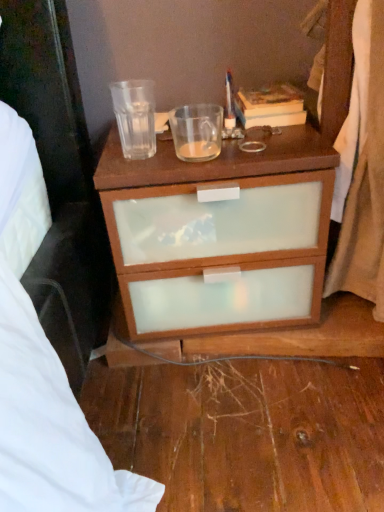
Question: Looking at the image, does white fabric curtain at right seem bigger or smaller compared to hardcover book at upper right?

Choices:
 (A) big
 (B) small

Answer: (A)

Question: Would you say white fabric curtain at right is inside or outside hardcover book at upper right?

Choices:
 (A) outside
 (B) inside

Answer: (A)

Question: Which is farther from the transparent glass at upper center, marked as the 2th coffee cup in a right-to-left arrangement?

Choices:
 (A) brown matte drawer at center
 (B) translucent glass coffee cup at upper center, which appears as the 1th coffee cup when viewed from the right
 (C) hardcover book at upper right
 (D) white fabric curtain at right

Answer: (D)

Question: Considering the real-world distances, which object is farthest from the translucent glass coffee cup at upper center, marked as the second coffee cup in a left-to-right arrangement?

Choices:
 (A) brown matte drawer at center
 (B) hardcover book at upper right
 (C) transparent glass at upper center, the 1th coffee cup from the left
 (D) white fabric curtain at right

Answer: (D)